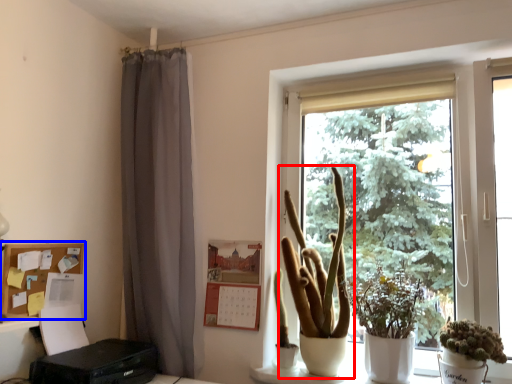
Question: Which object appears closest to the camera in this image, houseplant (highlighted by a red box) or shelf (highlighted by a blue box)?

Choices:
 (A) houseplant
 (B) shelf

Answer: (A)